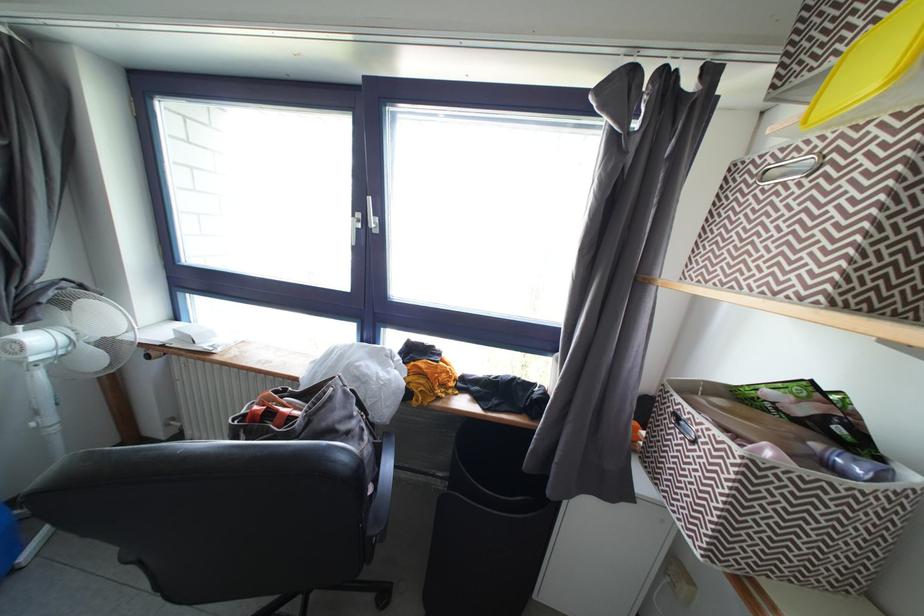
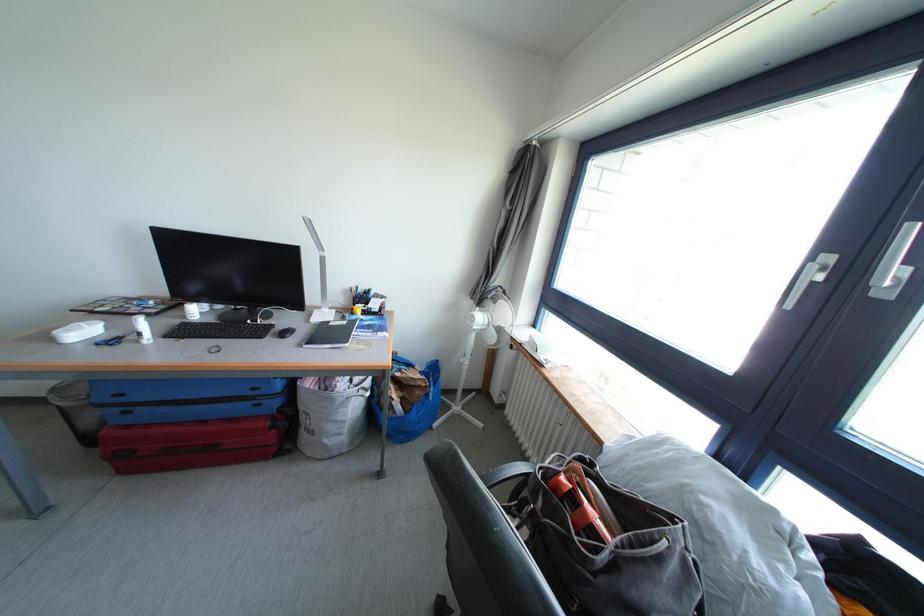
Question: Based on the continuous images, in which direction is the camera rotating? Reply with the corresponding letter.

Choices:
 (A) Left
 (B) Right
 (C) Up
 (D) Down

Answer: (A)